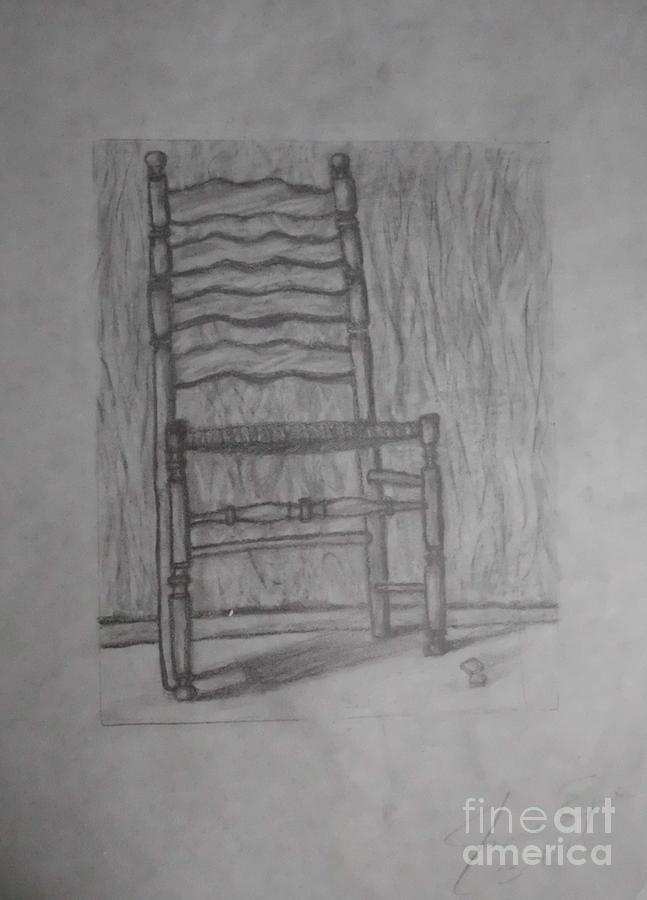
Where is `baseboard on wall`? baseboard on wall is located at coordinates (459, 616).